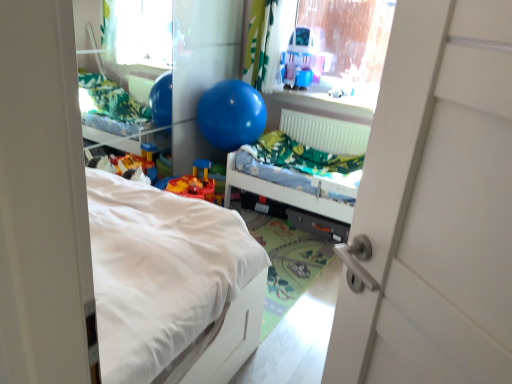
Question: Does green fabric curtain at upper center have a smaller size compared to transparent plastic window screen at upper center?

Choices:
 (A) no
 (B) yes

Answer: (B)

Question: Is transparent plastic window screen at upper center at the back of green fabric curtain at upper center?

Choices:
 (A) no
 (B) yes

Answer: (A)

Question: From the image's perspective, would you say green fabric curtain at upper center is positioned over transparent plastic window screen at upper center?

Choices:
 (A) no
 (B) yes

Answer: (A)

Question: Is green fabric curtain at upper center shorter than transparent plastic window screen at upper center?

Choices:
 (A) no
 (B) yes

Answer: (A)

Question: From the image's perspective, is green fabric curtain at upper center under transparent plastic window screen at upper center?

Choices:
 (A) no
 (B) yes

Answer: (B)

Question: Does point (309, 66) appear closer or farther from the camera than point (380, 46)?

Choices:
 (A) closer
 (B) farther

Answer: (A)

Question: Considering their positions, is translucent plastic playhouse at upper center located in front of or behind transparent plastic window screen at upper center?

Choices:
 (A) front
 (B) behind

Answer: (B)

Question: Based on their positions, is translucent plastic playhouse at upper center located to the left or right of transparent plastic window screen at upper center?

Choices:
 (A) left
 (B) right

Answer: (A)

Question: From a real-world perspective, relative to transparent plastic window screen at upper center, is translucent plastic playhouse at upper center vertically above or below?

Choices:
 (A) below
 (B) above

Answer: (A)

Question: In the image, is transparent plastic window screen at upper center on the left side or the right side of translucent plastic playhouse at upper center?

Choices:
 (A) left
 (B) right

Answer: (B)

Question: Relative to translucent plastic playhouse at upper center, is transparent plastic window screen at upper center in front or behind?

Choices:
 (A) front
 (B) behind

Answer: (A)

Question: Considering the positions of point (330, 18) and point (292, 43), is point (330, 18) closer or farther from the camera than point (292, 43)?

Choices:
 (A) farther
 (B) closer

Answer: (A)

Question: In terms of width, does transparent plastic window screen at upper center look wider or thinner when compared to translucent plastic playhouse at upper center?

Choices:
 (A) wide
 (B) thin

Answer: (B)

Question: From the image's perspective, relative to translucent plastic playhouse at upper center, is blue rubber balloon at upper center above or below?

Choices:
 (A) above
 (B) below

Answer: (B)

Question: Is point click(x=227, y=97) closer or farther from the camera than point click(x=303, y=29)?

Choices:
 (A) closer
 (B) farther

Answer: (A)